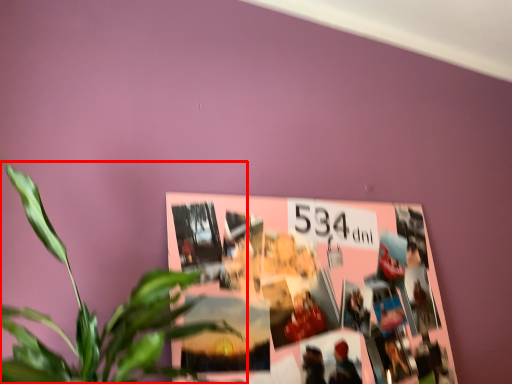
Question: From the image's perspective, where is houseplant (annotated by the red box) located in relation to bulletin board in the image?

Choices:
 (A) above
 (B) below

Answer: (A)